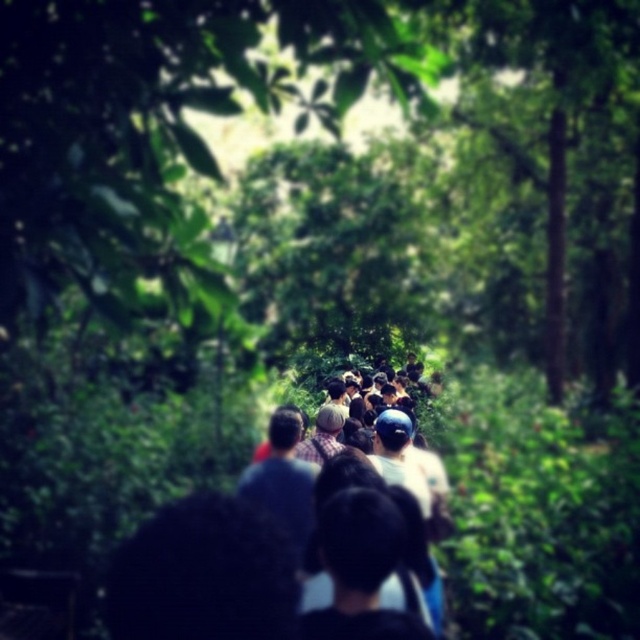
Question: Is green leafy tree at center smaller than dark hair at center?

Choices:
 (A) no
 (B) yes

Answer: (A)

Question: Which of the following is the closest to the observer?

Choices:
 (A) (406, 554)
 (B) (93, 28)

Answer: (B)

Question: Which point appears farthest from the camera in this image?

Choices:
 (A) (248, 81)
 (B) (276, 548)

Answer: (B)

Question: Can you confirm if green leafy tree at center is thinner than dark hair at center?

Choices:
 (A) yes
 (B) no

Answer: (A)

Question: Can you confirm if green leafy tree at center is thinner than dark hair at center?

Choices:
 (A) yes
 (B) no

Answer: (A)